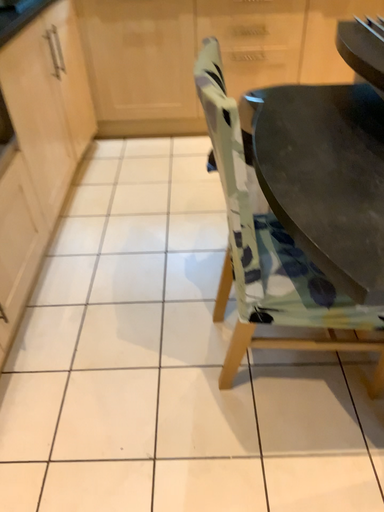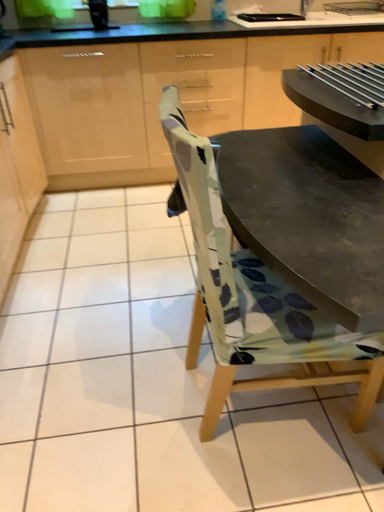
Question: How did the camera likely rotate when shooting the video?

Choices:
 (A) rotated right
 (B) rotated left

Answer: (A)